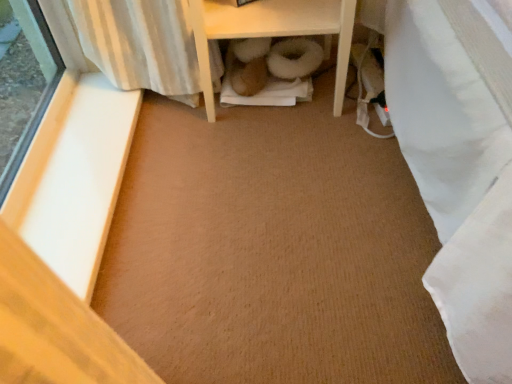
Question: Does white smooth wood at left appear on the left side of white wood shelf at center?

Choices:
 (A) yes
 (B) no

Answer: (A)

Question: Can you confirm if white smooth wood at left is taller than white wood shelf at center?

Choices:
 (A) no
 (B) yes

Answer: (A)

Question: Is white smooth wood at left facing away from white wood shelf at center?

Choices:
 (A) no
 (B) yes

Answer: (A)

Question: Does white smooth wood at left appear on the right side of white wood shelf at center?

Choices:
 (A) no
 (B) yes

Answer: (A)

Question: Can you confirm if white smooth wood at left is thinner than white wood shelf at center?

Choices:
 (A) no
 (B) yes

Answer: (B)

Question: Does white smooth wood at left lie in front of white wood shelf at center?

Choices:
 (A) no
 (B) yes

Answer: (B)

Question: From the image's perspective, does white wood shelf at center appear higher than white smooth wood at left?

Choices:
 (A) no
 (B) yes

Answer: (B)

Question: Can you confirm if white wood shelf at center is shorter than white smooth wood at left?

Choices:
 (A) no
 (B) yes

Answer: (A)

Question: From a real-world perspective, is white wood shelf at center below white smooth wood at left?

Choices:
 (A) no
 (B) yes

Answer: (A)

Question: Is white wood shelf at center positioned before white smooth wood at left?

Choices:
 (A) no
 (B) yes

Answer: (A)

Question: Is white wood shelf at center wider than white smooth wood at left?

Choices:
 (A) no
 (B) yes

Answer: (B)

Question: Is white smooth wood at left at the back of white wood shelf at center?

Choices:
 (A) no
 (B) yes

Answer: (A)

Question: From a real-world perspective, is white wood shelf at center physically located above or below white smooth wood at left?

Choices:
 (A) above
 (B) below

Answer: (A)